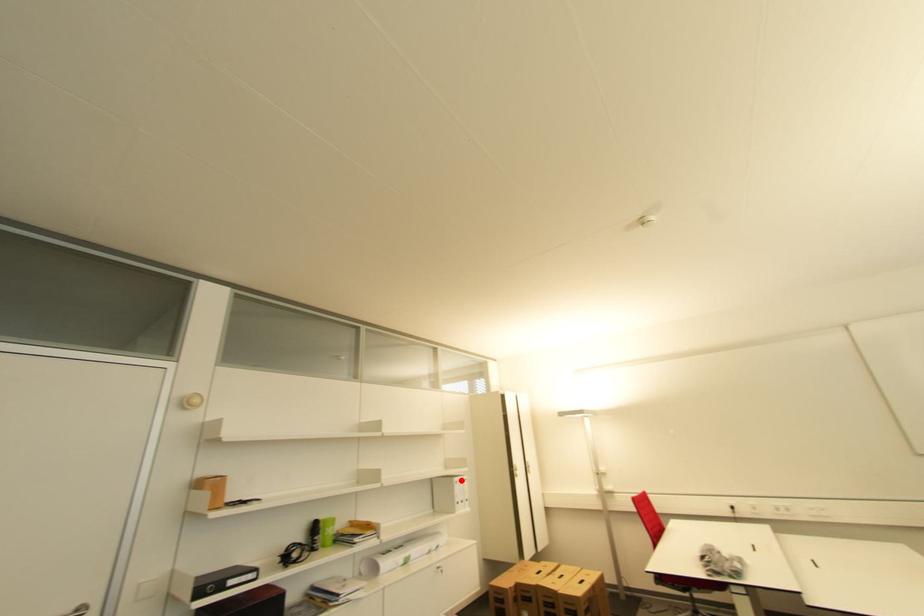
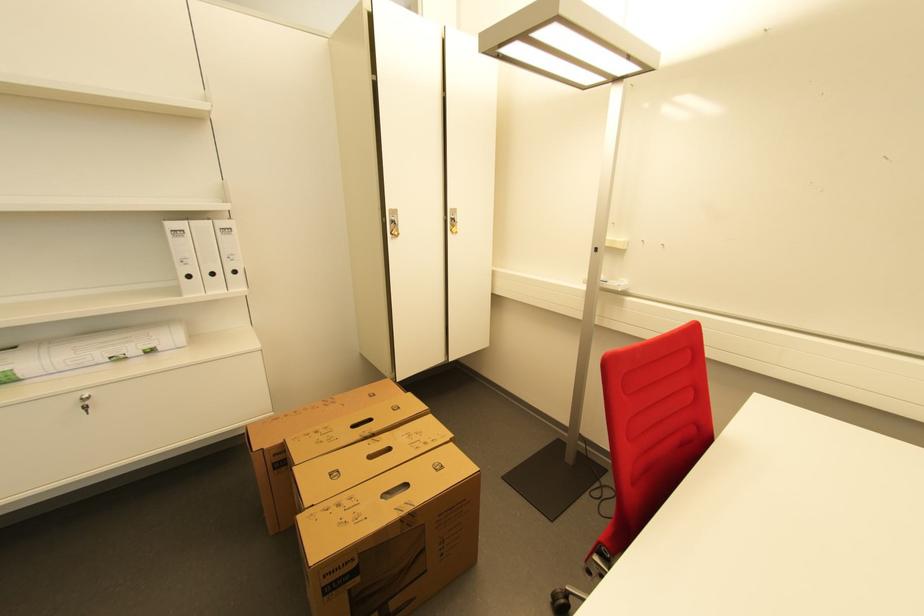
Find the pixel in the second image that matches the highlighted location in the first image.

(176, 225)